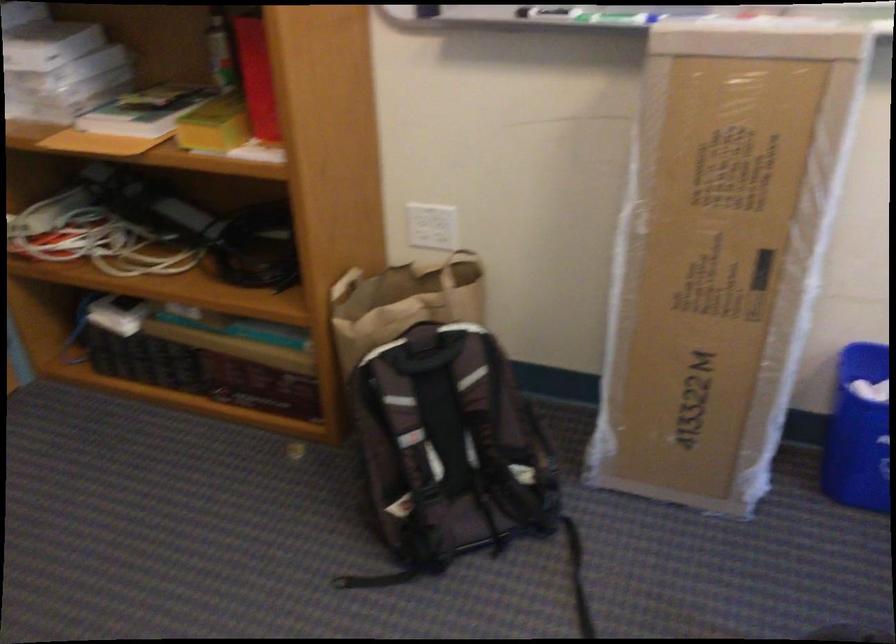
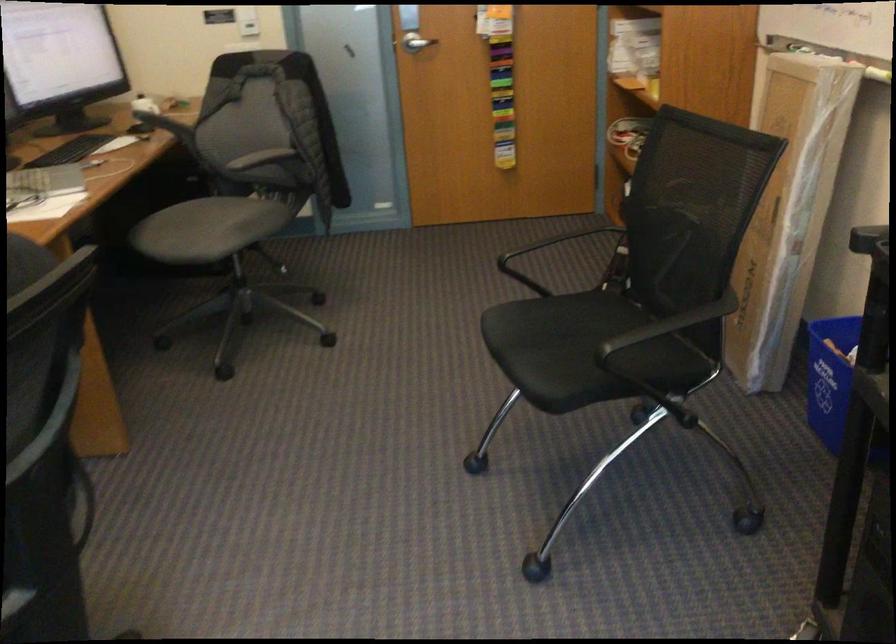
In the second image, find the point that corresponds to point 170,500 in the first image.

(573, 259)